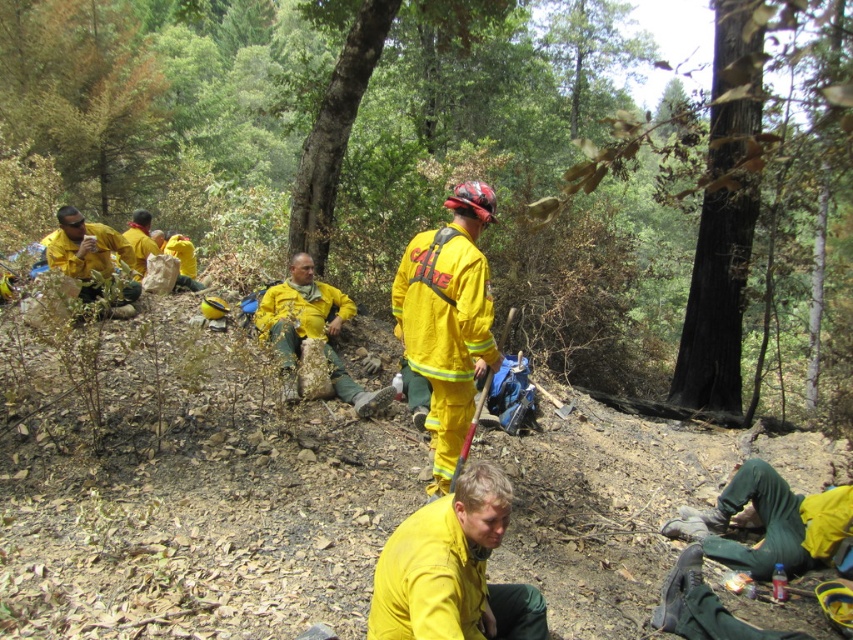
Please look at the coordinates provided. Which object is located at point (x=453, y=570)?

The point (x=453, y=570) indicates the yellow matte uniform at lower center.

You are a photographer trying to capture a group photo of the firefighters. You want to ensure both the yellow fabric uniform at center and the yellow reflective uniform at center are visible in the frame. Since you can only focus on one uniform at a time, which one should you focus on to ensure the other remains in the background?

You should focus on the yellow reflective uniform at center because the yellow fabric uniform at center is to the right of it, so the latter will stay in the background.

You are a drone operator tasked with monitoring the firefighters. You need to ensure that the yellow fabric uniform at center and the yellow matte uniform at lower center are within a safe communication range of 10 meters. Are they within range?

The distance between the yellow fabric uniform at center and the yellow matte uniform at lower center is 10.34 meters, which exceeds the 10 meter safe communication range. Therefore, they are not within the required range.